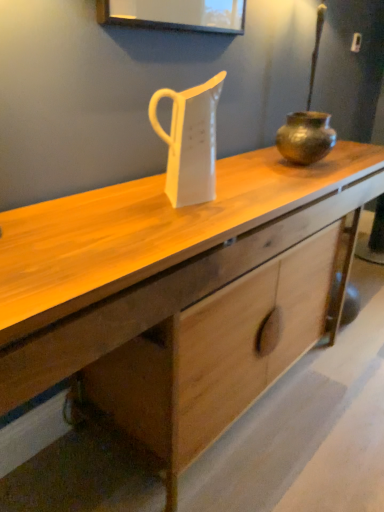
Describe the element at coordinates (307, 120) in the screenshot. I see `bronze metallic pot at right` at that location.

Find the location of a particular element. The height and width of the screenshot is (512, 384). white glossy jug at center is located at coordinates (190, 141).

Is bronze textured pot at center not within wooden desk at center?

bronze textured pot at center is positioned outside wooden desk at center.

Would you say bronze textured pot at center is a long distance from wooden desk at center?

That's not correct — bronze textured pot at center is a little close to wooden desk at center.

Does point (310, 136) lie behind point (101, 214)?

Yes.

Is bronze metallic pot at right positioned far away from bronze textured pot at center?

No, bronze metallic pot at right is in close proximity to bronze textured pot at center.

Between bronze metallic pot at right and bronze textured pot at center, which one has more height?

With more height is bronze metallic pot at right.

From the image's perspective, between bronze metallic pot at right and bronze textured pot at center, who is located below?

bronze textured pot at center, from the image's perspective.

In terms of width, does bronze metallic pot at right look wider or thinner when compared to bronze textured pot at center?

bronze metallic pot at right is wider than bronze textured pot at center.

At what (x,y) coordinates should I click in order to perform the action: click on vase directly beneath the white glossy jug at center (from a real-world perspective). Please return your answer as a coordinate pair (x, y). This screenshot has width=384, height=512. Looking at the image, I should click on (306, 137).

Considering the positions of point (176, 177) and point (301, 128), is point (176, 177) closer or farther from the camera than point (301, 128)?

Point (176, 177).

Consider the image. What's the angular difference between white glossy jug at center and bronze textured pot at center's facing directions?

The angle between the facing direction of white glossy jug at center and the facing direction of bronze textured pot at center is 4.71 degrees.

From the image's perspective, is white glossy jug at center above or below bronze textured pot at center?

white glossy jug at center is below bronze textured pot at center.

Is bronze metallic pot at right at the right side of wooden desk at center?

Yes.

Considering the relative sizes of bronze metallic pot at right and wooden desk at center in the image provided, is bronze metallic pot at right smaller than wooden desk at center?

Yes.

Is point (317, 151) in front of point (79, 243)?

No, (317, 151) is behind (79, 243).

Considering the sizes of bronze metallic pot at right and wooden desk at center in the image, is bronze metallic pot at right taller or shorter than wooden desk at center?

Considering their sizes, bronze metallic pot at right has less height than wooden desk at center.

Considering the relative sizes of bronze textured pot at center and white glossy jug at center in the image provided, is bronze textured pot at center shorter than white glossy jug at center?

Indeed, bronze textured pot at center has a lesser height compared to white glossy jug at center.

Can you confirm if bronze textured pot at center is thinner than white glossy jug at center?

Incorrect, the width of bronze textured pot at center is not less than that of white glossy jug at center.

Image resolution: width=384 pixels, height=512 pixels. I want to click on vase above the white glossy jug at center (from the image's perspective), so click(x=306, y=137).

From the image's perspective, is bronze textured pot at center below white glossy jug at center?

No, from the image's perspective, bronze textured pot at center is not beneath white glossy jug at center.

Who is taller, wooden desk at center or bronze metallic pot at right?

Standing taller between the two is wooden desk at center.

Which object is closer to the camera, wooden desk at center or bronze metallic pot at right?

wooden desk at center is in front.

How much distance is there between wooden desk at center and bronze metallic pot at right?

19.38 inches.

Is bronze metallic pot at right at the back of wooden desk at center?

wooden desk at center does not have its back to bronze metallic pot at right.

At what (x,y) coordinates should I click in order to perform the action: click on candle holder lying on the right of white glossy jug at center. Please return your answer as a coordinate pair (x, y). Looking at the image, I should click on (307, 120).

Is bronze metallic pot at right completely or partially outside of white glossy jug at center?

Yes, bronze metallic pot at right is located beyond the bounds of white glossy jug at center.

From the picture: Is bronze metallic pot at right looking in the opposite direction of white glossy jug at center?

That's not correct — bronze metallic pot at right is not looking away from white glossy jug at center.

Can you confirm if bronze metallic pot at right is thinner than white glossy jug at center?

Incorrect, the width of bronze metallic pot at right is not less than that of white glossy jug at center.

Locate an element on the screen. Image resolution: width=384 pixels, height=512 pixels. vase behind the wooden desk at center is located at coordinates (306, 137).

Locate an element on the screen. The height and width of the screenshot is (512, 384). candle holder to the right of bronze textured pot at center is located at coordinates (307, 120).

When comparing their distances from bronze metallic pot at right, does wooden desk at center or bronze textured pot at center seem further?

Based on the image, wooden desk at center appears to be further to bronze metallic pot at right.

Estimate the real-world distances between objects in this image. Which object is closer to bronze metallic pot at right, white glossy jug at center or wooden desk at center?

Based on the image, wooden desk at center appears to be nearer to bronze metallic pot at right.

Considering their positions, is white glossy jug at center positioned closer to wooden desk at center than bronze textured pot at center?

Based on the image, white glossy jug at center appears to be nearer to wooden desk at center.

Looking at this image, based on their spatial positions, is white glossy jug at center or bronze metallic pot at right closer to wooden desk at center?

The object closer to wooden desk at center is white glossy jug at center.

From the image, which object appears to be farther from white glossy jug at center, wooden desk at center or bronze textured pot at center?

Among the two, bronze textured pot at center is located further to white glossy jug at center.

Which object lies further to the anchor point white glossy jug at center, bronze metallic pot at right or wooden desk at center?

Among the two, bronze metallic pot at right is located further to white glossy jug at center.

Considering their positions, is bronze textured pot at center positioned further to bronze metallic pot at right than wooden desk at center?

wooden desk at center.

Looking at the image, which one is located closer to white glossy jug at center, wooden desk at center or bronze metallic pot at right?

Based on the image, wooden desk at center appears to be nearer to white glossy jug at center.

This screenshot has width=384, height=512. I want to click on vase between white glossy jug at center and bronze metallic pot at right from left to right, so click(x=306, y=137).

This screenshot has height=512, width=384. Identify the location of vase located between wooden desk at center and bronze metallic pot at right in the depth direction. (306, 137).

Locate an element on the screen. This screenshot has height=512, width=384. jug between wooden desk at center and bronze metallic pot at right along the z-axis is located at coordinates (190, 141).

At what (x,y) coordinates should I click in order to perform the action: click on jug between wooden desk at center and bronze textured pot at center from front to back. Please return your answer as a coordinate pair (x, y). The width and height of the screenshot is (384, 512). Looking at the image, I should click on (190, 141).